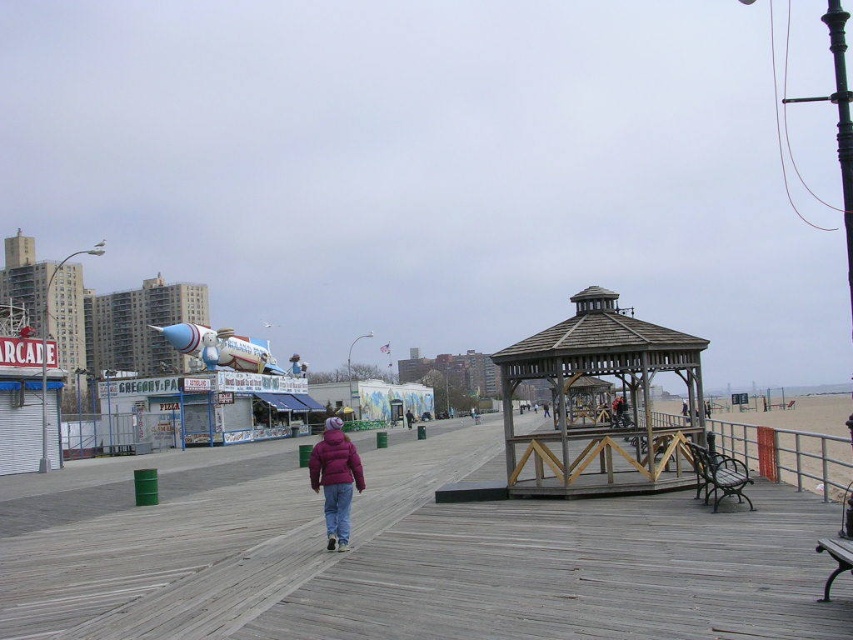
Question: Can you confirm if wooden at center is wider than purple matte jacket at center?

Choices:
 (A) no
 (B) yes

Answer: (B)

Question: Which point is closer to the camera taking this photo?

Choices:
 (A) (321, 481)
 (B) (549, 340)
 (C) (315, 488)

Answer: (A)

Question: Which of the following is the closest to the observer?

Choices:
 (A) (351, 477)
 (B) (613, 342)
 (C) (358, 465)
 (D) (136, 588)

Answer: (D)

Question: Which object is farther from the camera taking this photo?

Choices:
 (A) wooden gazebo at center
 (B) maroon puffy jacket at center
 (C) wooden at center

Answer: (A)

Question: Is wooden at center positioned before purple matte jacket at center?

Choices:
 (A) no
 (B) yes

Answer: (B)

Question: Is wooden gazebo at center to the left of maroon puffy jacket at center from the viewer's perspective?

Choices:
 (A) yes
 (B) no

Answer: (B)